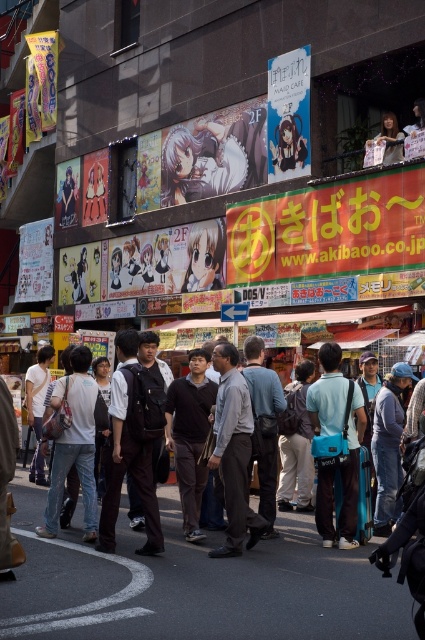
You are a delivery person standing at the entrance of the street. You need to locate the dark gray suit at center. Based on the coordinates provided, can you determine the direction you should walk to reach it?

The dark gray suit at center is located at coordinates point (218, 444). Since the coordinate system typically places the origin at the bottom left corner, a higher x value indicates moving to the right and a higher y value indicates moving upwards. Therefore, to reach the dark gray suit at center, you should walk towards the upper right direction from your current position at the entrance.

You are a delivery person who needs to carry both the dark gray suit at center and the teal fabric backpack at center through a narrow alleyway. Since the alleyway has a low ceiling, which item might you need to adjust to ensure you can pass through without hitting your head?

The dark gray suit at center has a lesser height compared to the teal fabric backpack at center, so you should adjust the teal fabric backpack at center since it is taller and more likely to hit the low ceiling in the alleyway.